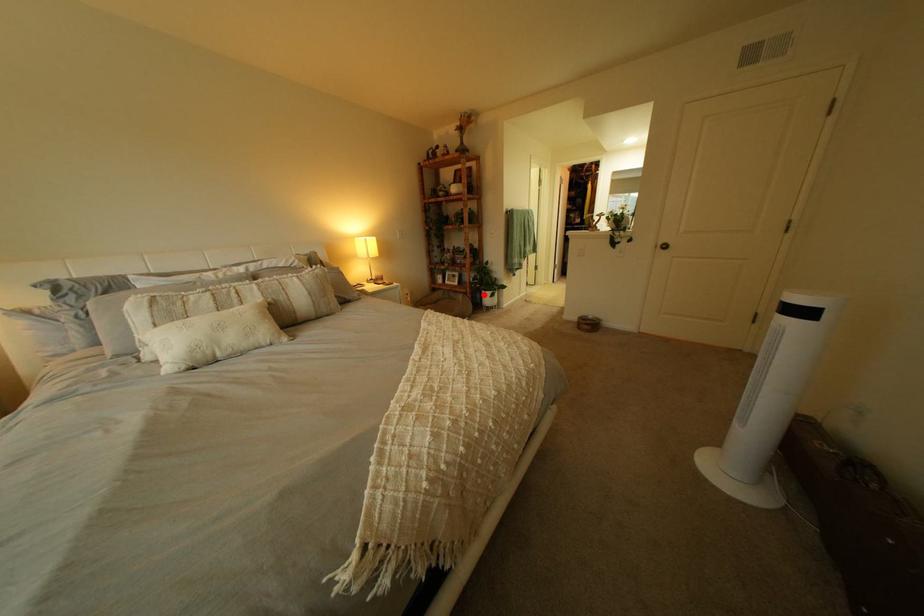
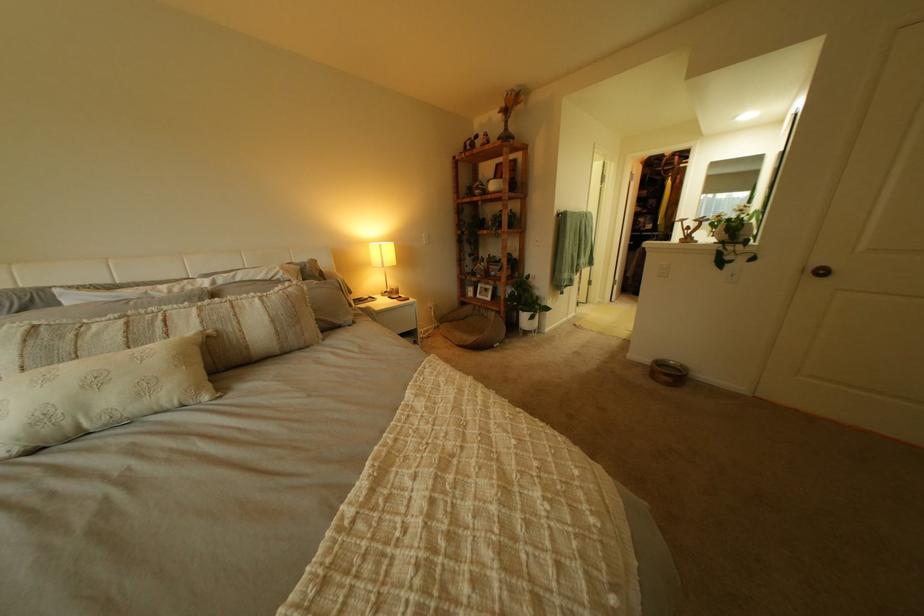
Question: I am providing you with two images of the same scene from different viewpoints. Image1 has a red point marked. In image2, the corresponding 3D location appears at what relative position? Reply with the corresponding letter.

Choices:
 (A) Closer
 (B) Farther

Answer: (B)